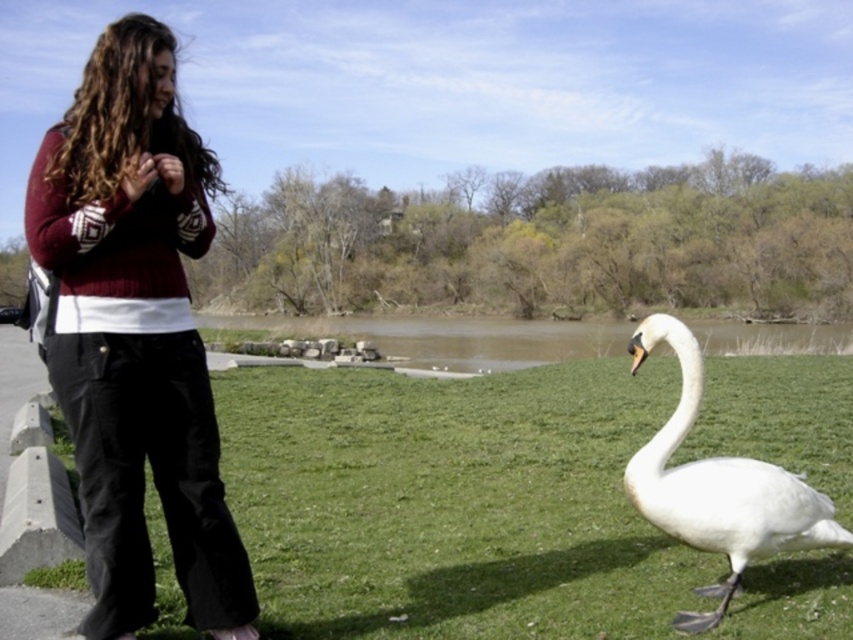
You are standing at the camera position and want to take a photo of the swan. There is a point at coordinates point (781, 636) that is 11.01 feet away from you. If your camera has a maximum focus range of 10 feet, will you be able to focus on the swan?

The point at point (781, 636) is 11.01 feet away from the camera, which exceeds the camera maximum focus range of 10 feet. Therefore, you will not be able to focus on the swan.

You are standing at the point labeled point (x=764, y=625) and want to walk to the point labeled point (x=409, y=365). Which direction should you move to reach your destination?

To reach point (x=409, y=365) from point (x=764, y=625), you should move towards the left and forward since point (x=764, y=625) is in front of point (x=409, y=365).